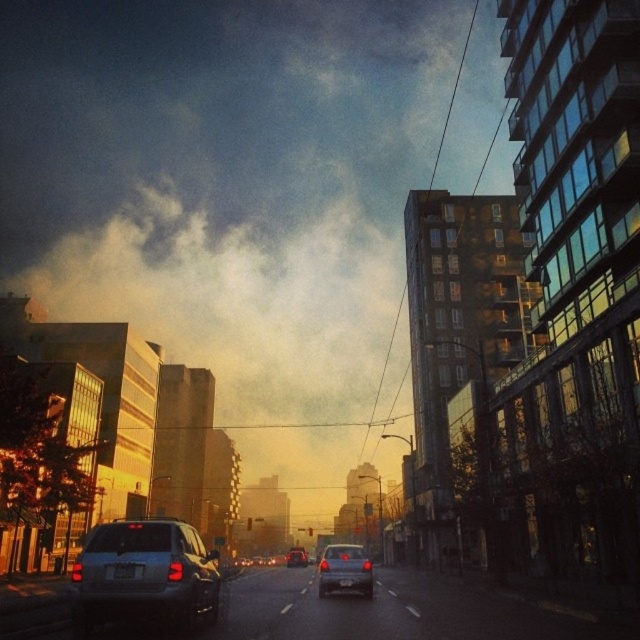
Which is above, satin silver sedan at center or shiny silver sedan at center?

satin silver sedan at center is above.

Measure the distance between satin silver sedan at center and camera.

satin silver sedan at center and camera are 17.92 meters apart from each other.

Measure the distance between point (340,566) and camera.

The distance of point (340,566) from camera is 59.89 feet.

Locate an element on the screen. The width and height of the screenshot is (640, 640). satin silver sedan at center is located at coordinates (344, 570).

From the picture: Can you confirm if smokey haze at upper center is shorter than satin silver sedan at center?

In fact, smokey haze at upper center may be taller than satin silver sedan at center.

Does point (248, 147) come in front of point (330, 573)?

No, it is not.

Is point (326, 1) behind point (324, 579)?

Yes.

This screenshot has width=640, height=640. In order to click on smokey haze at upper center in this screenshot , I will do `click(232, 198)`.

Does smokey haze at upper center have a greater width compared to satin silver suv at center?

Correct, the width of smokey haze at upper center exceeds that of satin silver suv at center.

Find the location of a particular element. smokey haze at upper center is located at coordinates (232, 198).

Does point (60, 125) come farther from viewer compared to point (180, 596)?

Yes, it is.

I want to click on smokey haze at upper center, so click(232, 198).